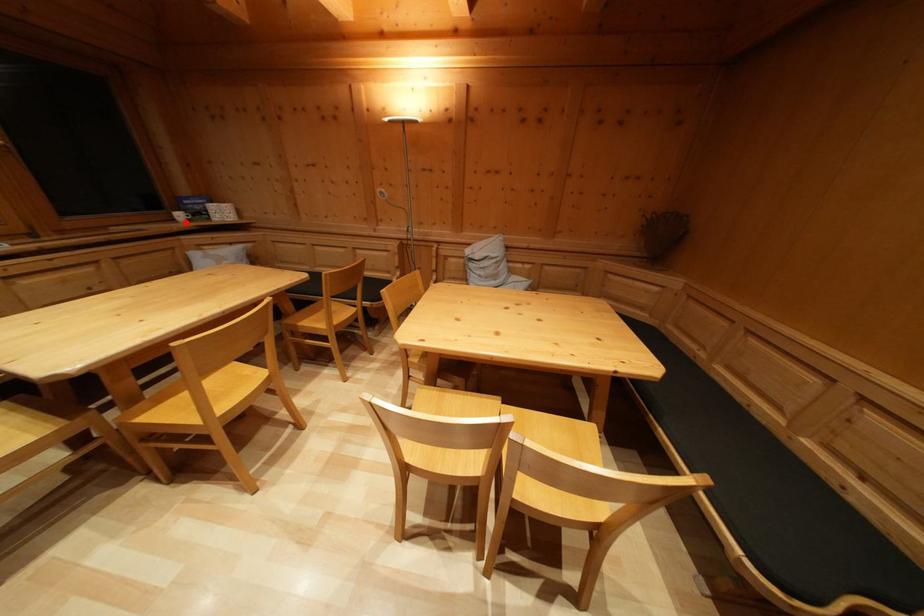
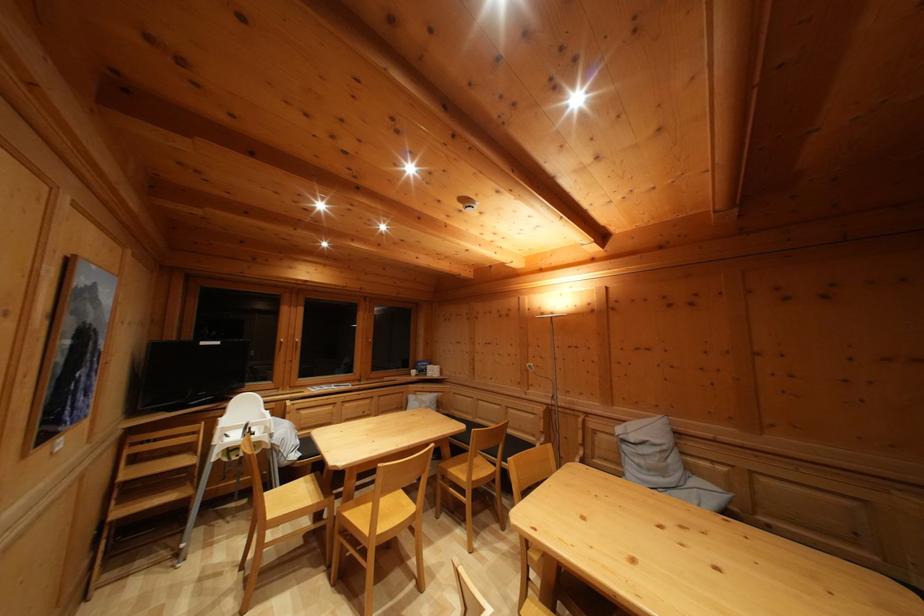
Locate, in the second image, the point that corresponds to the highlighted location in the first image.

(419, 379)